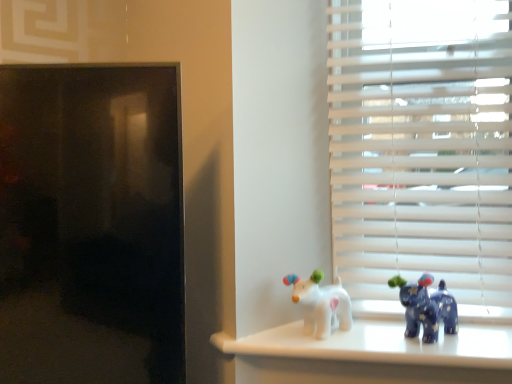
Question: Considering the positions of blue glossy elephant at right, acting as the second toy starting from the left, and white matte blinds at right in the image, is blue glossy elephant at right, acting as the second toy starting from the left, bigger or smaller than white matte blinds at right?

Choices:
 (A) small
 (B) big

Answer: (A)

Question: From the image's perspective, is blue glossy elephant at right, acting as the second toy starting from the left, above or below white matte blinds at right?

Choices:
 (A) above
 (B) below

Answer: (B)

Question: Based on their relative distances, which object is nearer to the white matte blinds at right?

Choices:
 (A) blue glossy elephant at right, acting as the second toy starting from the left
 (B) white glossy dog at center, positioned as the 1th toy in left-to-right order

Answer: (A)

Question: Which object is positioned closest to the white matte blinds at right?

Choices:
 (A) white glossy dog at center, the second toy in the right-to-left sequence
 (B) blue glossy elephant at right, arranged as the first toy when viewed from the right

Answer: (B)